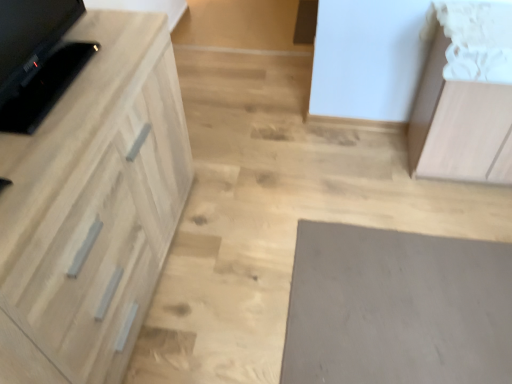
Question: Considering the relative sizes of light brown wood cabinet at upper right, the 2th cabinetry viewed from the left, and light wood cabinet at left, acting as the 2th cabinetry starting from the right, in the image provided, is light brown wood cabinet at upper right, the 2th cabinetry viewed from the left, smaller than light wood cabinet at left, acting as the 2th cabinetry starting from the right,?

Choices:
 (A) yes
 (B) no

Answer: (A)

Question: Is light wood cabinet at left, acting as the 2th cabinetry starting from the right, at the back of light brown wood cabinet at upper right, the 1th cabinetry when ordered from right to left?

Choices:
 (A) yes
 (B) no

Answer: (B)

Question: Does light brown wood cabinet at upper right, the 1th cabinetry when ordered from right to left, have a lesser width compared to light wood cabinet at left, acting as the 2th cabinetry starting from the right?

Choices:
 (A) no
 (B) yes

Answer: (B)

Question: Are light brown wood cabinet at upper right, the 1th cabinetry when ordered from right to left, and light wood cabinet at left, the 1th cabinetry when ordered from left to right, making contact?

Choices:
 (A) yes
 (B) no

Answer: (B)

Question: Does light brown wood cabinet at upper right, the 1th cabinetry when ordered from right to left, have a greater width compared to light wood cabinet at left, acting as the 2th cabinetry starting from the right?

Choices:
 (A) yes
 (B) no

Answer: (B)

Question: Is light brown wood cabinet at upper right, the 1th cabinetry when ordered from right to left, situated inside gray matte mat at lower right or outside?

Choices:
 (A) outside
 (B) inside

Answer: (A)

Question: In the image, is light brown wood cabinet at upper right, the 2th cabinetry viewed from the left, positioned in front of or behind gray matte mat at lower right?

Choices:
 (A) front
 (B) behind

Answer: (B)

Question: In the image, is light brown wood cabinet at upper right, the 1th cabinetry when ordered from right to left, on the left side or the right side of gray matte mat at lower right?

Choices:
 (A) left
 (B) right

Answer: (B)

Question: Is light brown wood cabinet at upper right, the 1th cabinetry when ordered from right to left, taller or shorter than gray matte mat at lower right?

Choices:
 (A) tall
 (B) short

Answer: (A)

Question: Looking at their shapes, would you say light wood cabinet at left, the 1th cabinetry when ordered from left to right, is wider or thinner than light brown wood cabinet at upper right, the 1th cabinetry when ordered from right to left?

Choices:
 (A) thin
 (B) wide

Answer: (B)

Question: Considering the positions of light wood cabinet at left, the 1th cabinetry when ordered from left to right, and light brown wood cabinet at upper right, the 1th cabinetry when ordered from right to left, in the image, is light wood cabinet at left, the 1th cabinetry when ordered from left to right, taller or shorter than light brown wood cabinet at upper right, the 1th cabinetry when ordered from right to left,?

Choices:
 (A) tall
 (B) short

Answer: (A)

Question: Is point (145, 241) positioned closer to the camera than point (438, 59)?

Choices:
 (A) farther
 (B) closer

Answer: (B)

Question: Is light wood cabinet at left, the 1th cabinetry when ordered from left to right, in front of or behind light brown wood cabinet at upper right, the 1th cabinetry when ordered from right to left, in the image?

Choices:
 (A) behind
 (B) front

Answer: (B)

Question: In terms of height, does light wood cabinet at left, acting as the 2th cabinetry starting from the right, look taller or shorter compared to black glossy tv at left?

Choices:
 (A) short
 (B) tall

Answer: (B)

Question: Is point (132, 178) closer or farther from the camera than point (20, 72)?

Choices:
 (A) closer
 (B) farther

Answer: (B)